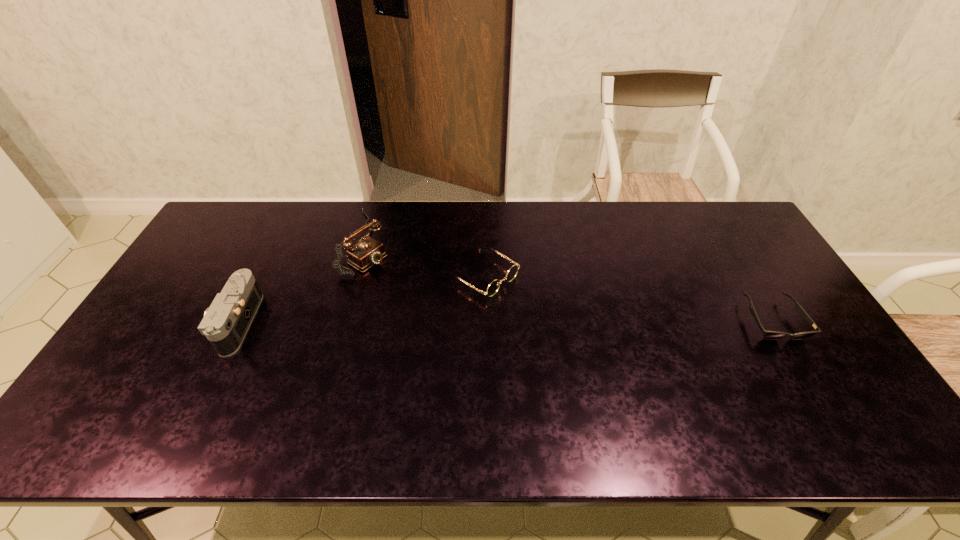
Locate an element on the screen. vacant area that lies between the second shortest object and the sunglasses is located at coordinates (628, 298).

The height and width of the screenshot is (540, 960). What are the coordinates of `vacant space that's between the third object from right to left and the sunglasses` in the screenshot? It's located at click(570, 281).

Locate an element on the screen. The width and height of the screenshot is (960, 540). free space between the leftmost object and the tallest object is located at coordinates (302, 282).

This screenshot has height=540, width=960. What are the coordinates of `vacant space that is in between the telephone and the third tallest object` in the screenshot? It's located at (425, 259).

Locate an element on the screen. This screenshot has height=540, width=960. vacant point located between the second shortest object and the camera is located at coordinates (360, 299).

Locate an element on the screen. object identified as the second closest to the spectacles is located at coordinates (226, 322).

The image size is (960, 540). What are the coordinates of `object that is the third nearest to the third object from left to right` in the screenshot? It's located at (769, 335).